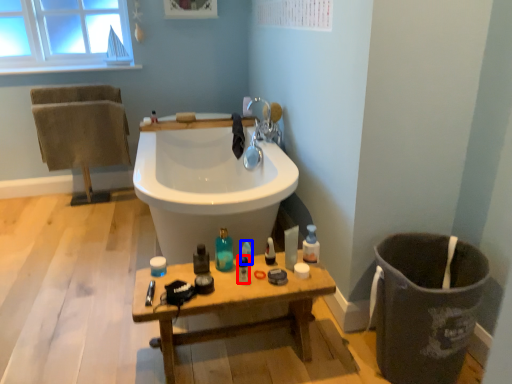
Question: Among these objects, which one is nearest to the camera, mouthwash (highlighted by a red box) or cleaning product (highlighted by a blue box)?

Choices:
 (A) mouthwash
 (B) cleaning product

Answer: (A)